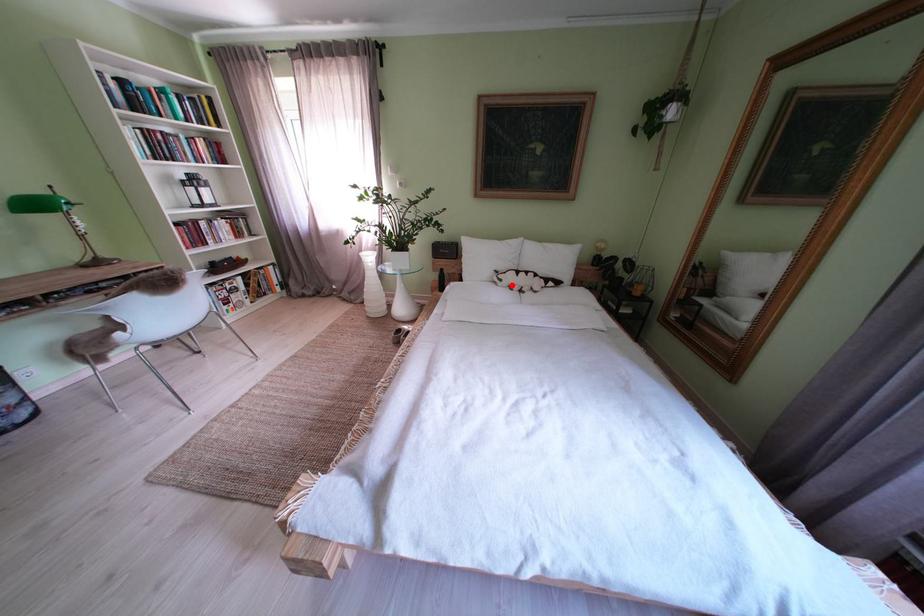
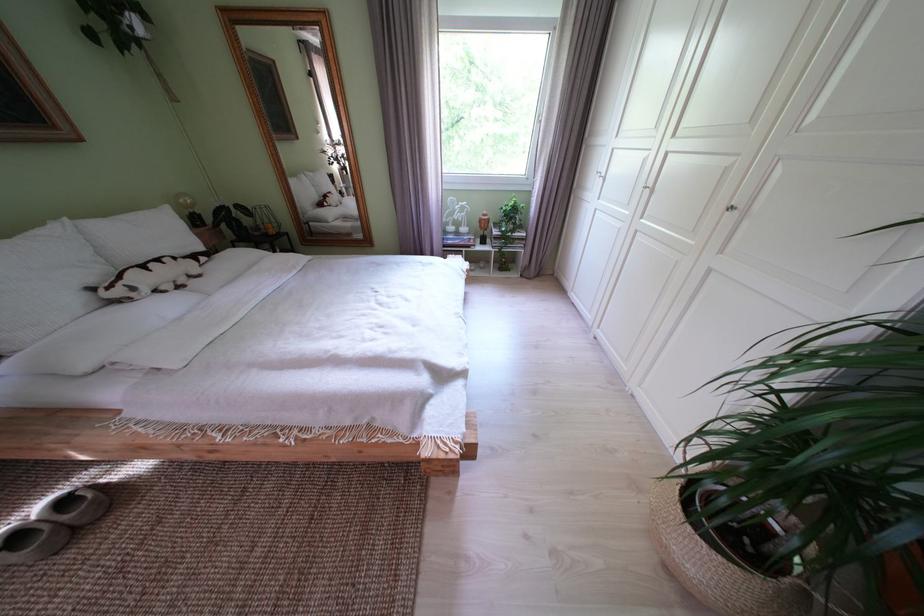
Find the pixel in the second image that matches the highlighted location in the first image.

(146, 294)